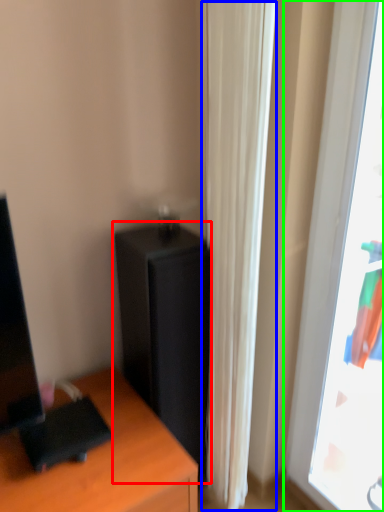
Question: Estimate the real-world distances between objects in this image. Which object is farther from file cabinet (highlighted by a red box), curtain (highlighted by a blue box) or window (highlighted by a green box)?

Choices:
 (A) curtain
 (B) window

Answer: (B)